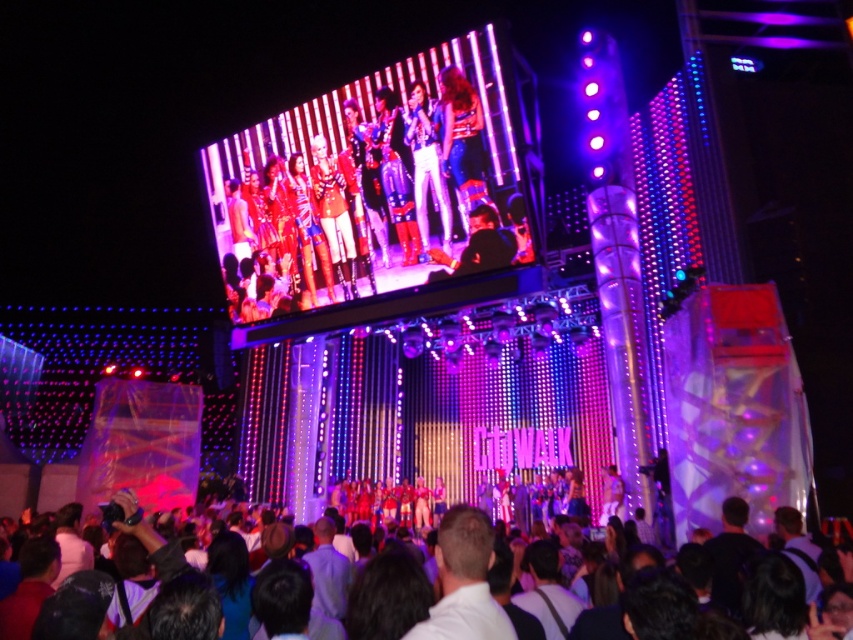
Question: Is shiny metallic jacket at center to the left of dark brown hair at lower center from the viewer's perspective?

Choices:
 (A) no
 (B) yes

Answer: (B)

Question: Which object appears farthest from the camera in this image?

Choices:
 (A) dark brown hair at lower center
 (B) shiny metallic jacket at center

Answer: (B)

Question: Does shiny metallic jacket at center have a greater width compared to dark brown hair at lower center?

Choices:
 (A) no
 (B) yes

Answer: (A)

Question: Which object is farther from the camera taking this photo?

Choices:
 (A) dark brown hair at lower center
 (B) shiny metallic jacket at center

Answer: (B)

Question: Does shiny metallic jacket at center have a lesser width compared to dark brown hair at lower center?

Choices:
 (A) yes
 (B) no

Answer: (A)